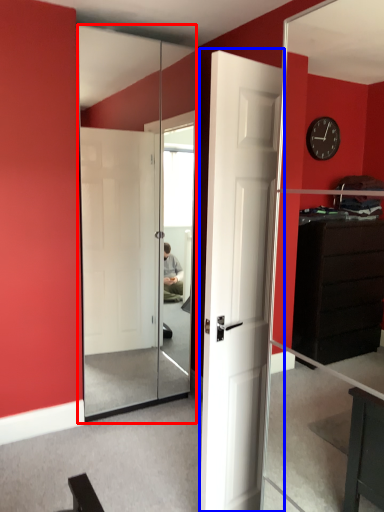
Question: Which object appears farthest to the camera in this image, screen door (highlighted by a red box) or door (highlighted by a blue box)?

Choices:
 (A) screen door
 (B) door

Answer: (A)